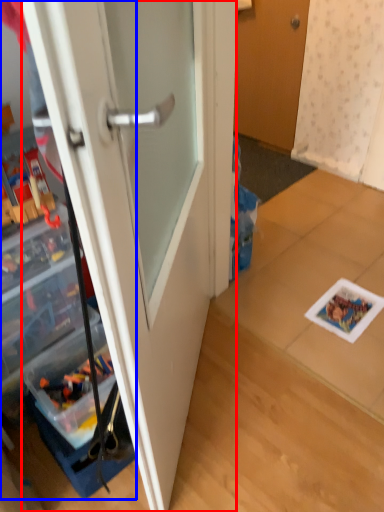
Question: Which object appears closest to the camera in this image, door (highlighted by a red box) or cabinetry (highlighted by a blue box)?

Choices:
 (A) door
 (B) cabinetry

Answer: (A)